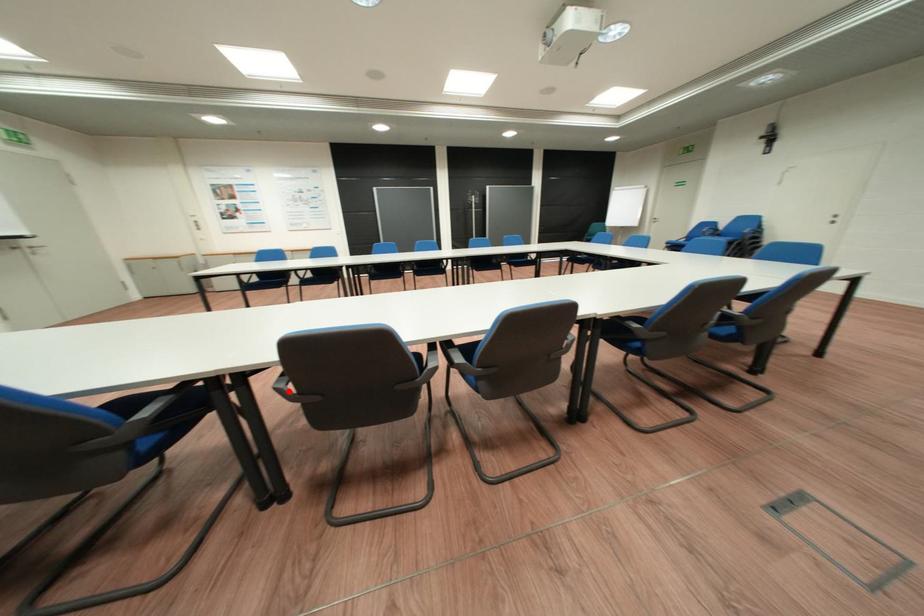
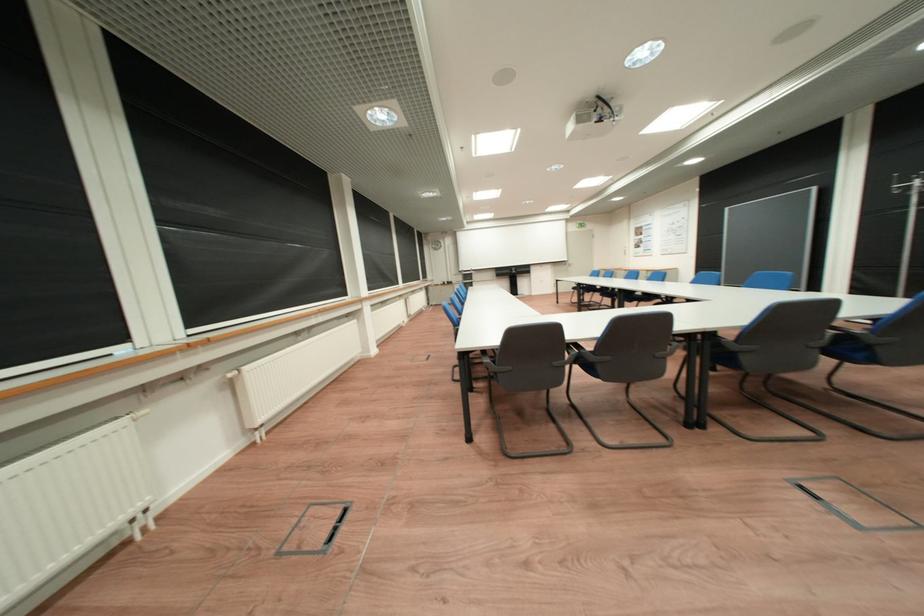
Question: I am providing you with two images of the same scene from different viewpoints. A red point is marked on the first image. Is the red point's position out of view in image 2?

Choices:
 (A) Yes
 (B) No

Answer: (A)